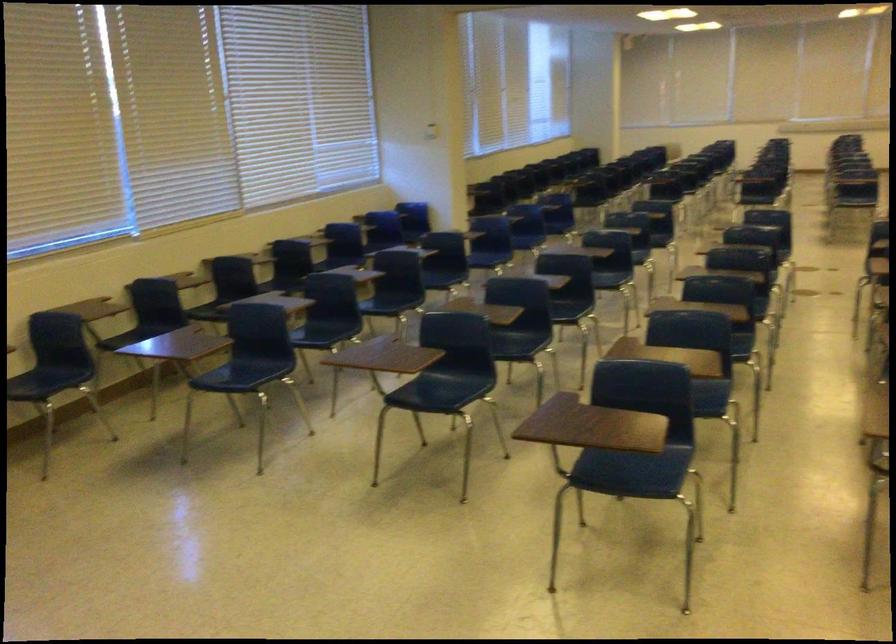
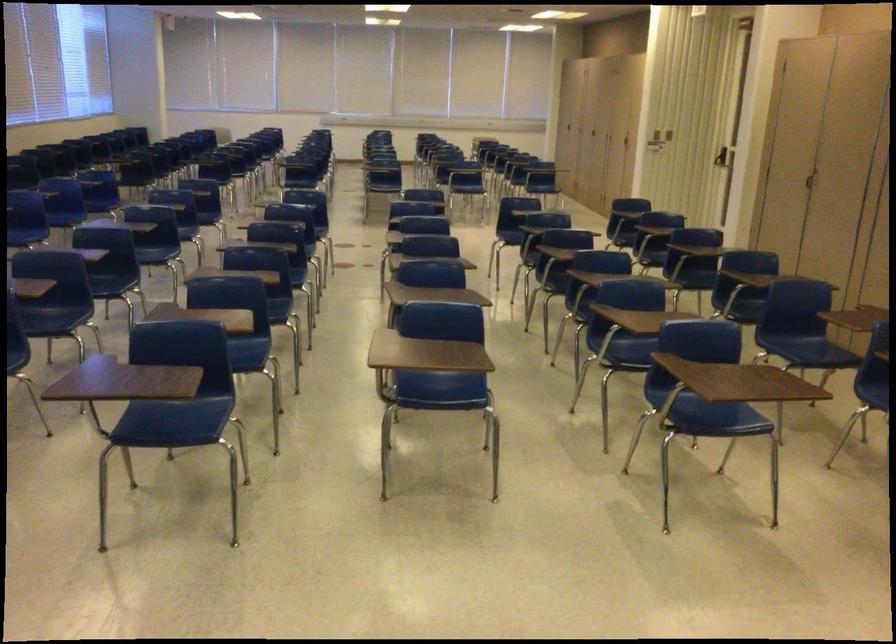
Which direction would the cameraman need to move to produce the second image?

The cameraman walked toward right, backward.